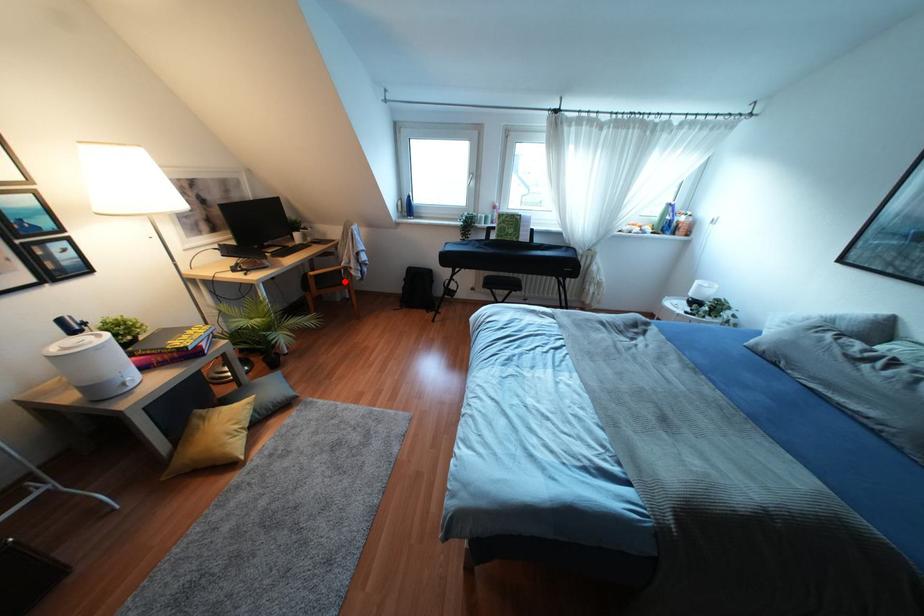
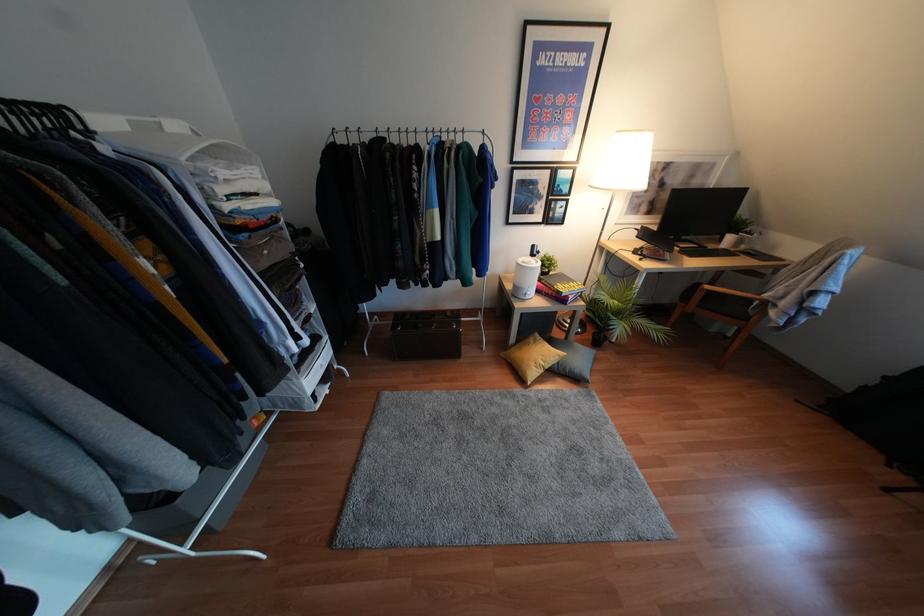
Question: I am providing you with two images of the same scene from different viewpoints. Image1 has a red point marked. In image2, the corresponding 3D location appears at what relative position? Reply with the corresponding letter.

Choices:
 (A) Closer
 (B) Farther

Answer: (B)